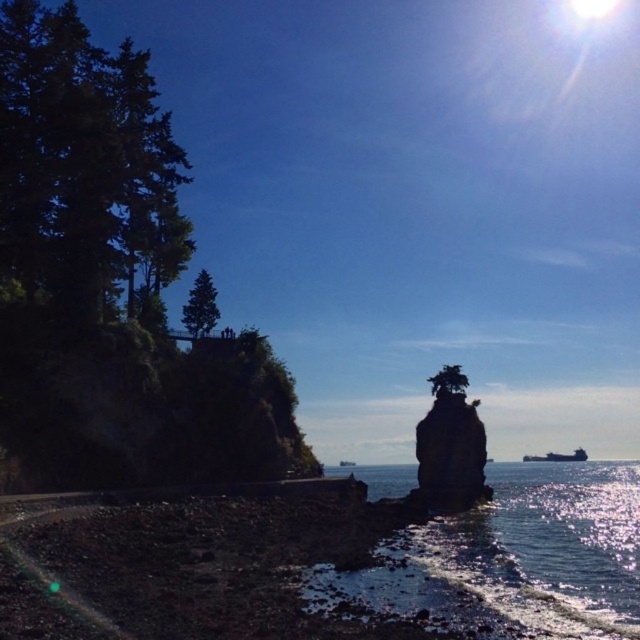
Question: In this image, where is green leafy tree at left located relative to green leafy tree at center?

Choices:
 (A) below
 (B) above

Answer: (B)

Question: Does green leafy tree at left have a greater width compared to shiny blue water at lower center?

Choices:
 (A) yes
 (B) no

Answer: (B)

Question: Which object appears farthest from the camera in this image?

Choices:
 (A) smooth gray rock at center
 (B) shiny blue water at lower center
 (C) green leafy tree at left
 (D) metallic gray ship at lower right

Answer: (D)

Question: Based on their relative distances, which object is farther from the shiny blue water at lower center?

Choices:
 (A) smooth gray rock at center
 (B) green leafy tree at left
 (C) green matte tree at upper left

Answer: (C)

Question: Which point is farther from the camera taking this photo?

Choices:
 (A) (436, 452)
 (B) (33, 28)
 (C) (193, 326)

Answer: (A)

Question: Does shiny blue water at lower center lie behind green leafy tree at center?

Choices:
 (A) yes
 (B) no

Answer: (B)